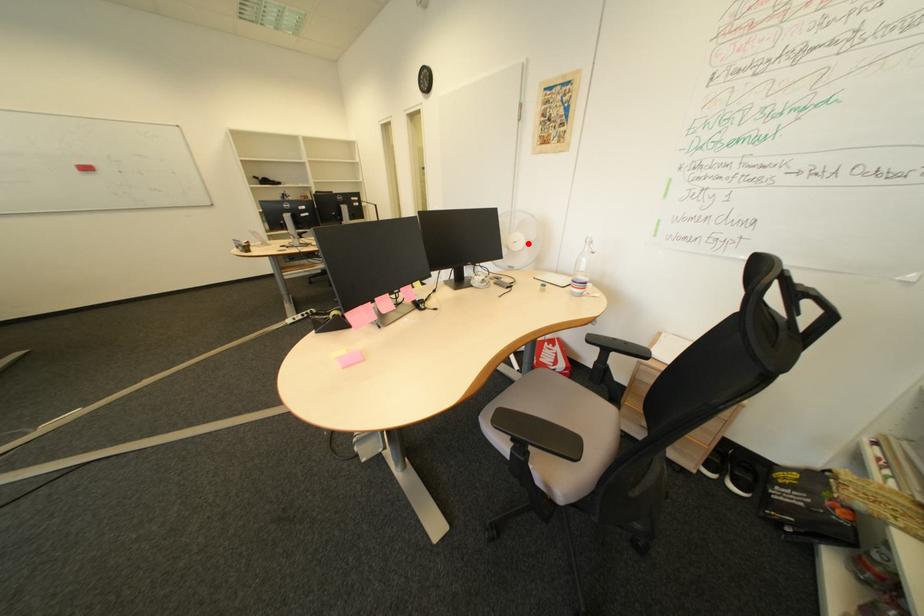
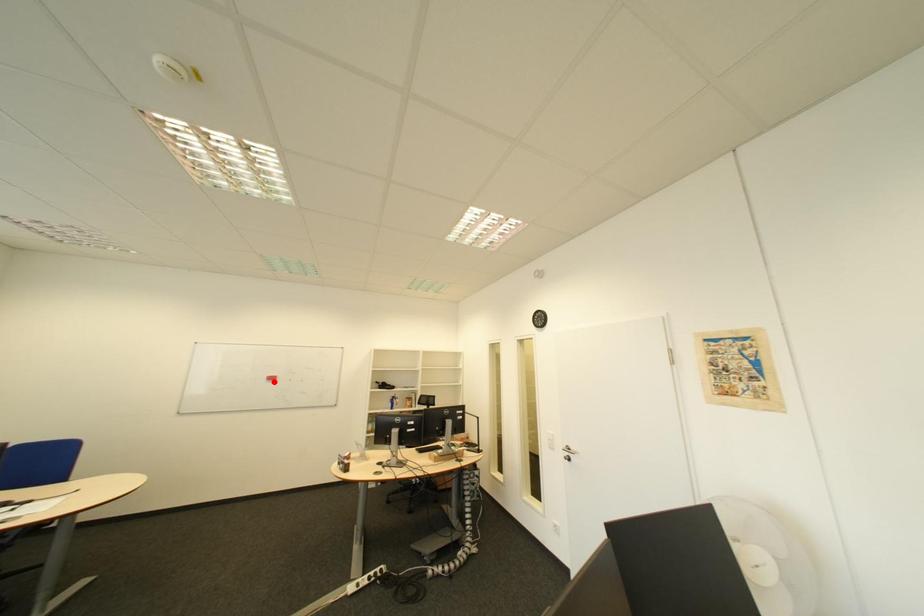
I am providing you with two images of the same scene from different viewpoints. A red point is marked on the first image and another point is marked on the second image. Is the red point in image1 aligned with the point shown in image2?

No